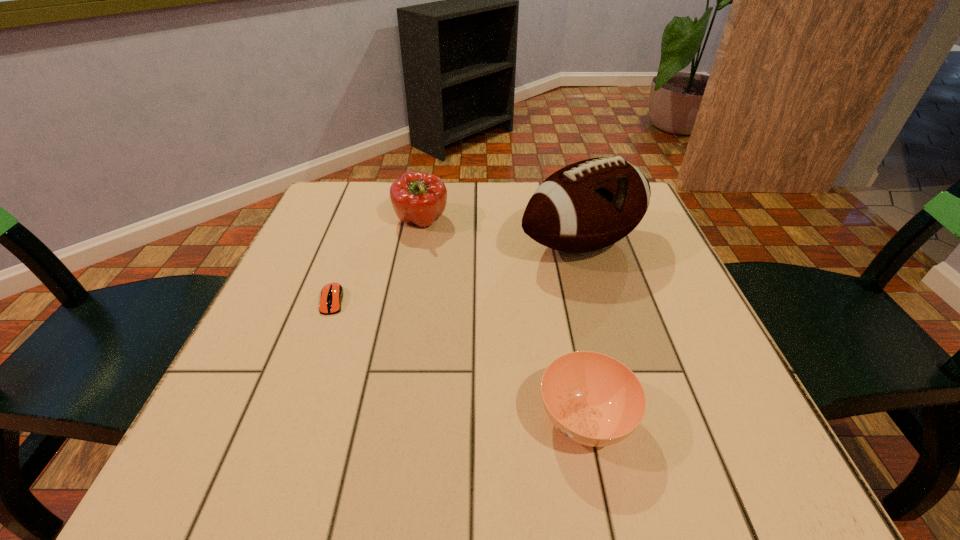
What are the coordinates of `football (American)` in the screenshot? It's located at (591, 204).

Where is `the second object from left to right`? This screenshot has width=960, height=540. the second object from left to right is located at coordinates (417, 197).

At what (x,y) coordinates should I click in order to perform the action: click on pepper. Please return your answer as a coordinate pair (x, y). Looking at the image, I should click on (417, 197).

The height and width of the screenshot is (540, 960). I want to click on the nearest object, so click(x=593, y=399).

This screenshot has height=540, width=960. Find the location of `the third tallest object`. the third tallest object is located at coordinates (593, 399).

You are a GUI agent. You are given a task and a screenshot of the screen. Output one action in this format:
    pyautogui.click(x=<x>, y=<y>)
    Task: Click on the leftmost object
    Image resolution: width=960 pixels, height=540 pixels.
    Given the screenshot: What is the action you would take?
    pyautogui.click(x=331, y=296)

Locate an element on the screen. This screenshot has width=960, height=540. computer mouse is located at coordinates (331, 296).

Find the location of a particular element. free location located on the front of the football (American) is located at coordinates (636, 433).

At what (x,y) coordinates should I click in order to perform the action: click on vacant space located on the back of the pepper. Please return your answer as a coordinate pair (x, y). Image resolution: width=960 pixels, height=540 pixels. Looking at the image, I should click on [427, 187].

I want to click on free space located on the back of the nearest object, so click(562, 300).